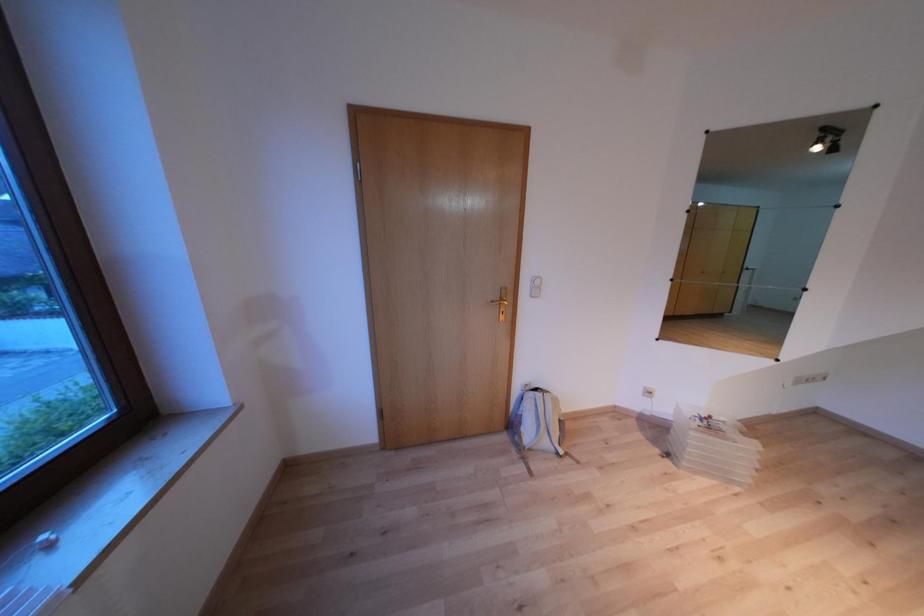
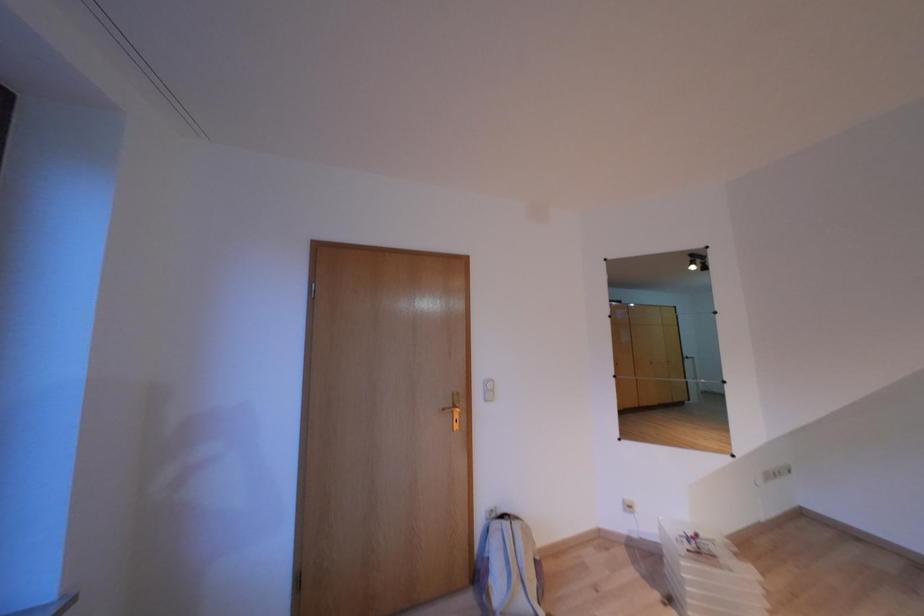
Question: How did the camera likely rotate?

Choices:
 (A) Left
 (B) Right
 (C) Up
 (D) Down

Answer: (C)